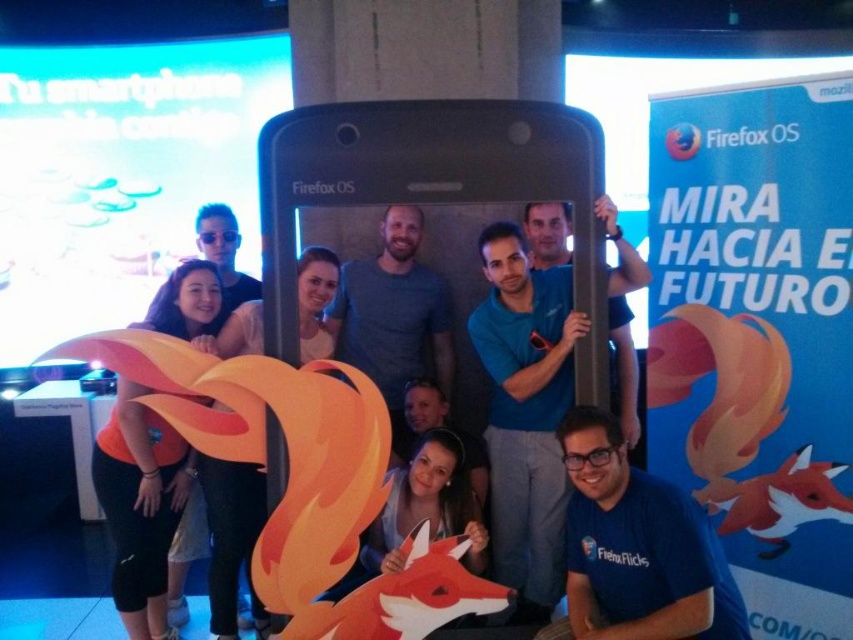
You are a photographer setting up for a group photo. You notice the matte black phone at center and the blue fabric shirt at center in the scene. Which object should you focus on first if you want to capture both in a single shot without moving the camera?

The matte black phone at center is larger in size than the blue fabric shirt at center, so you should focus on the larger matte black phone at center first to ensure it is sharp and centered properly in the frame.